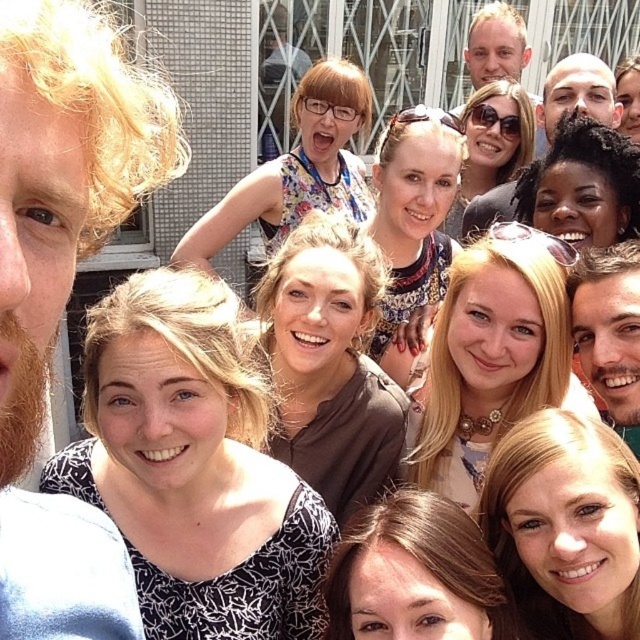
Which of these two, white printed blouse at center or sunglasses at center, stands shorter?

sunglasses at center is shorter.

Locate an element on the screen. The image size is (640, 640). white printed blouse at center is located at coordinates (193, 467).

Locate an element on the screen. The width and height of the screenshot is (640, 640). blonde hair at center is located at coordinates (490, 362).

Who is more distant from viewer, (436, 445) or (428, 250)?

Positioned behind is point (428, 250).

Where is `blonde hair at center`? The height and width of the screenshot is (640, 640). blonde hair at center is located at coordinates (490, 362).

Does matte brown hair at center appear over blonde hair at center?

Actually, matte brown hair at center is below blonde hair at center.

Does matte brown hair at center appear under blonde hair at center?

Yes.

Which is behind, point (337, 381) or point (412, 467)?

The point (337, 381) is more distant.

Locate an element on the screen. The image size is (640, 640). matte brown hair at center is located at coordinates (330, 364).